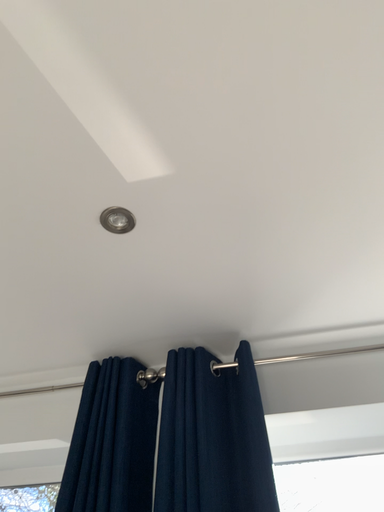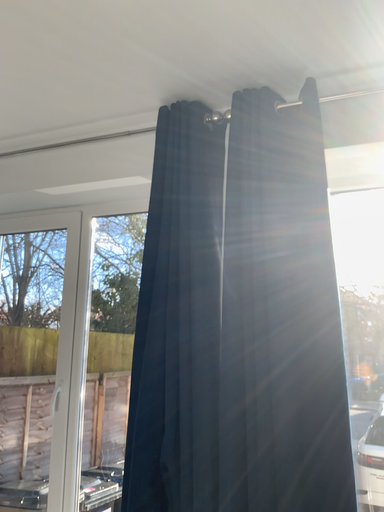
Question: Which way did the camera rotate in the video?

Choices:
 (A) rotated downward
 (B) rotated upward

Answer: (A)